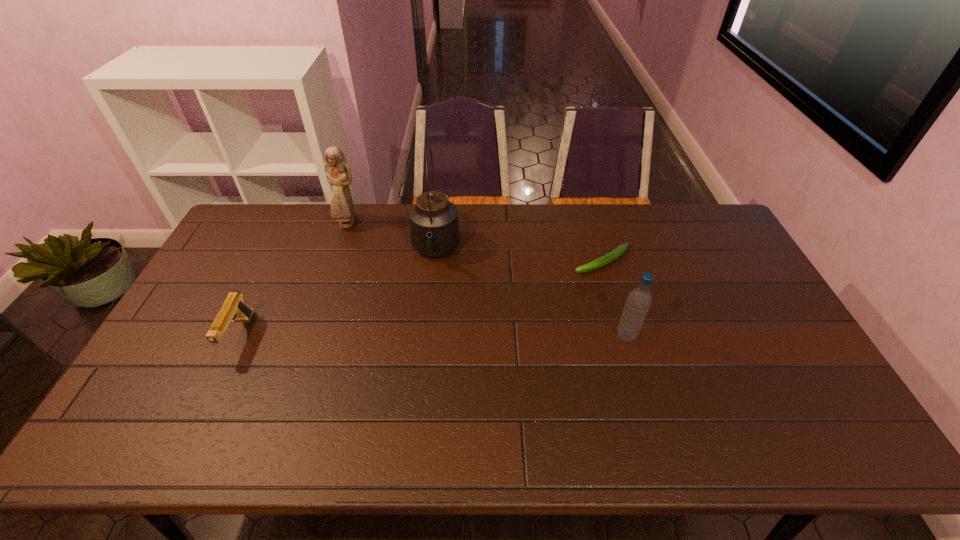
Image resolution: width=960 pixels, height=540 pixels. Find the location of `free space on the desktop that is between the second shortest object and the water bottle and is positioned on the front-facing side of the shortest object`. free space on the desktop that is between the second shortest object and the water bottle and is positioned on the front-facing side of the shortest object is located at coordinates (457, 336).

Identify the location of vacant space on the desktop that is between the pistol and the water bottle and is positioned spout on the kettle. (428, 336).

This screenshot has height=540, width=960. What are the coordinates of `vacant spot on the desktop that is between the pistol and the third shortest object and is positioned on the front-facing side of the second tallest object` in the screenshot? It's located at (403, 336).